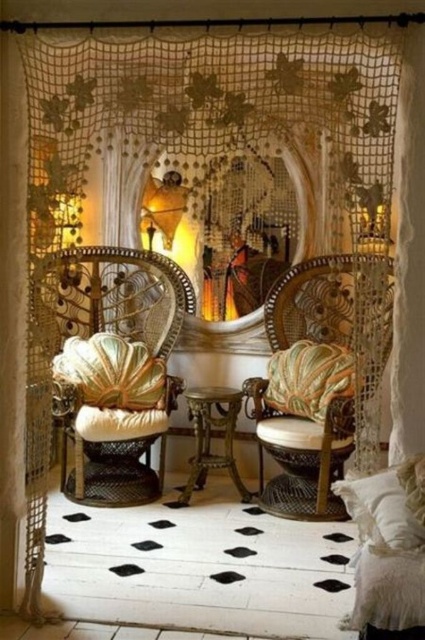
Is matte wicker armchair at center positioned in front of white fluffy pillow at lower right?

No, matte wicker armchair at center is behind white fluffy pillow at lower right.

Which is more to the left, matte wicker armchair at center or white fluffy pillow at lower right?

matte wicker armchair at center is more to the left.

Is point (277, 298) positioned before point (390, 524)?

That is False.

Where is `matte wicker armchair at center`? matte wicker armchair at center is located at coordinates (303, 452).

Between point (99, 355) and point (289, 360), which one is positioned in front?

Positioned in front is point (289, 360).

Is point (141, 435) positioned in front of point (350, 362)?

Yes, it is.

Is point (90, 429) farther from viewer compared to point (320, 346)?

No, (90, 429) is in front of (320, 346).

Find the location of `velvet gold armchair at left`. velvet gold armchair at left is located at coordinates (116, 368).

Between point (79, 406) and point (268, 506), which one is positioned in front?

Positioned in front is point (79, 406).

Who is higher up, velvet gold armchair at left or matte wicker armchair at center?

velvet gold armchair at left

Identify the location of velvet gold armchair at left. This screenshot has height=640, width=425. (116, 368).